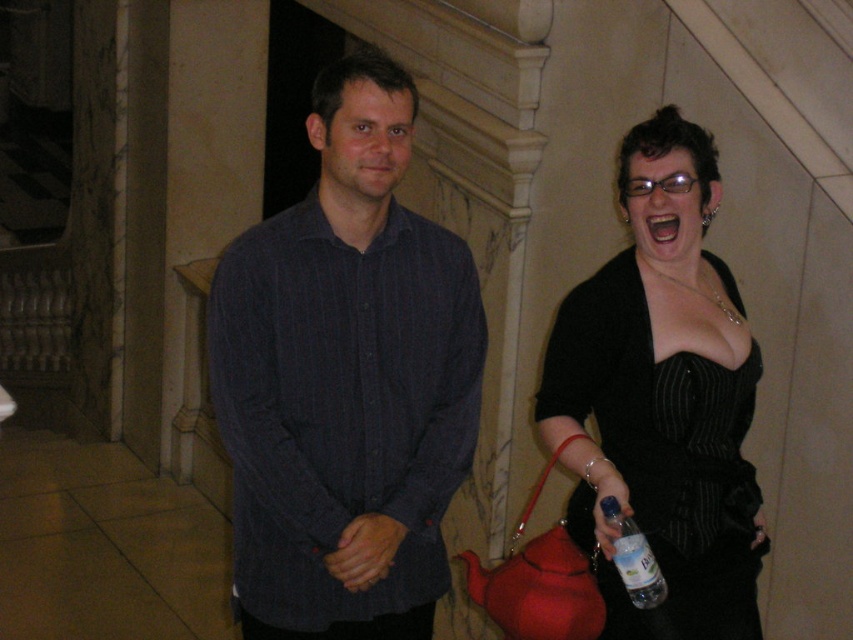
Question: Can you confirm if black satin dress at right is thinner than clear plastic bottle at lower right?

Choices:
 (A) yes
 (B) no

Answer: (B)

Question: Observing the image, what is the correct spatial positioning of dark blue striped shirt at center in reference to clear plastic bottle at lower right?

Choices:
 (A) above
 (B) below

Answer: (A)

Question: Which point is closer to the camera?

Choices:
 (A) (635, 323)
 (B) (633, 552)

Answer: (B)

Question: Which point is closer to the camera?

Choices:
 (A) dark blue striped shirt at center
 (B) clear plastic bottle at lower right

Answer: (B)

Question: Which of the following is the closest to the observer?

Choices:
 (A) clear plastic bottle at lower right
 (B) black satin dress at right

Answer: (A)

Question: In this image, where is dark blue striped shirt at center located relative to black satin dress at right?

Choices:
 (A) right
 (B) left

Answer: (B)